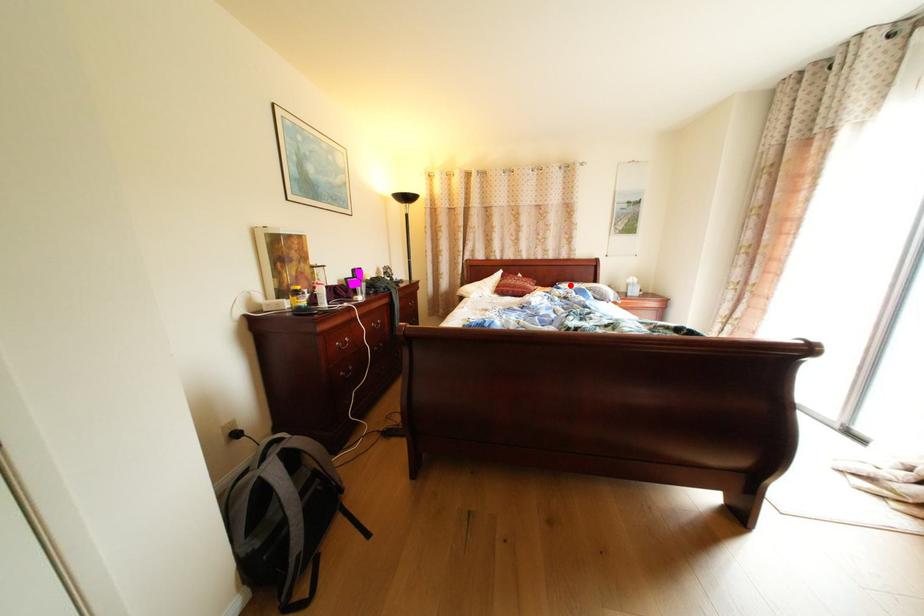
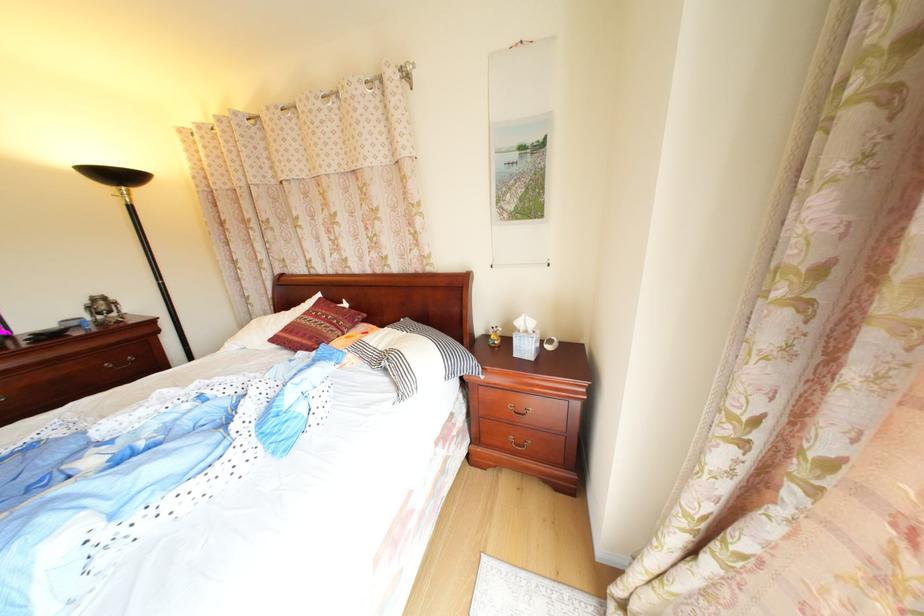
Find the pixel in the second image that matches the highlighted location in the first image.

(415, 322)